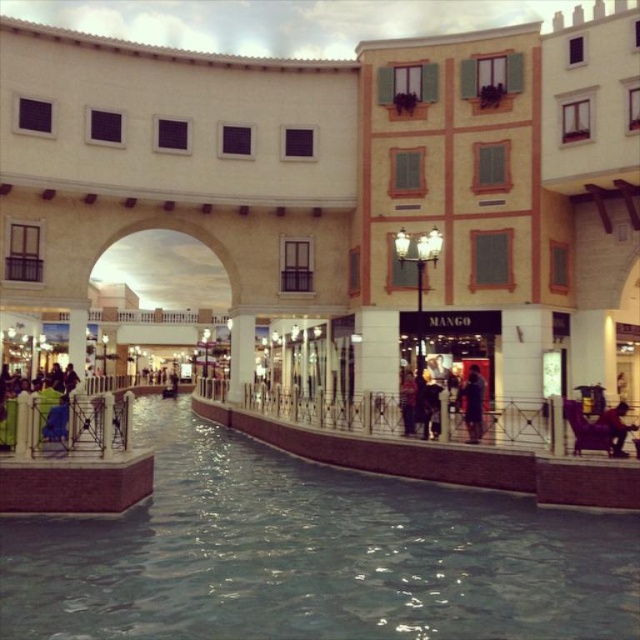
You are a customer in this shopping area and you see the dark blue jeans at center and the dark brown leather jacket at lower right. Which item is placed higher up in the scene?

The dark blue jeans at center is positioned over dark brown leather jacket at lower right, so it is placed higher up in the scene.

You are standing in the shopping area and want to take a photo of the clear water at center and the dark brown leather jacket at lower right. Which object will appear larger in your photo?

The clear water at center will appear larger in your photo because it is closer to the viewer than the dark brown leather jacket at lower right.